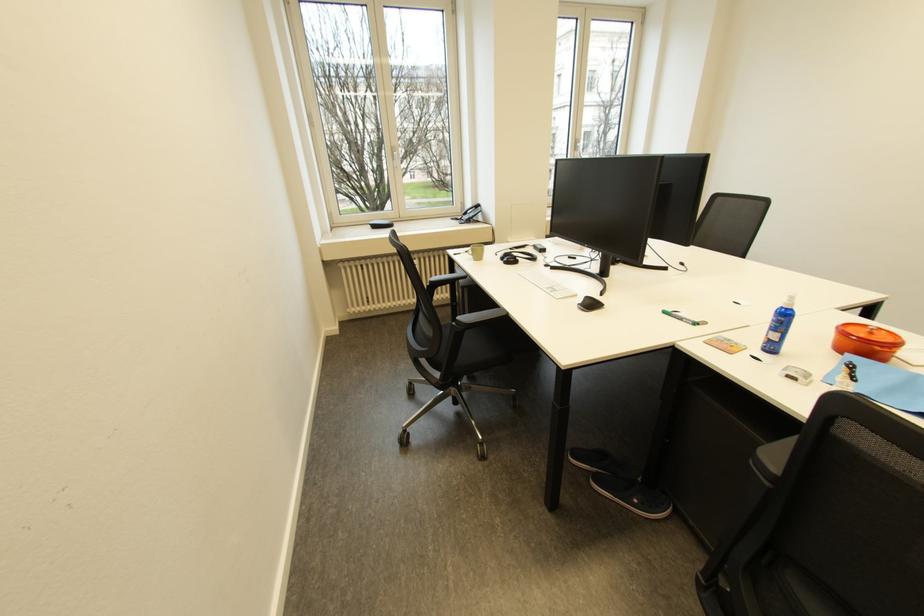
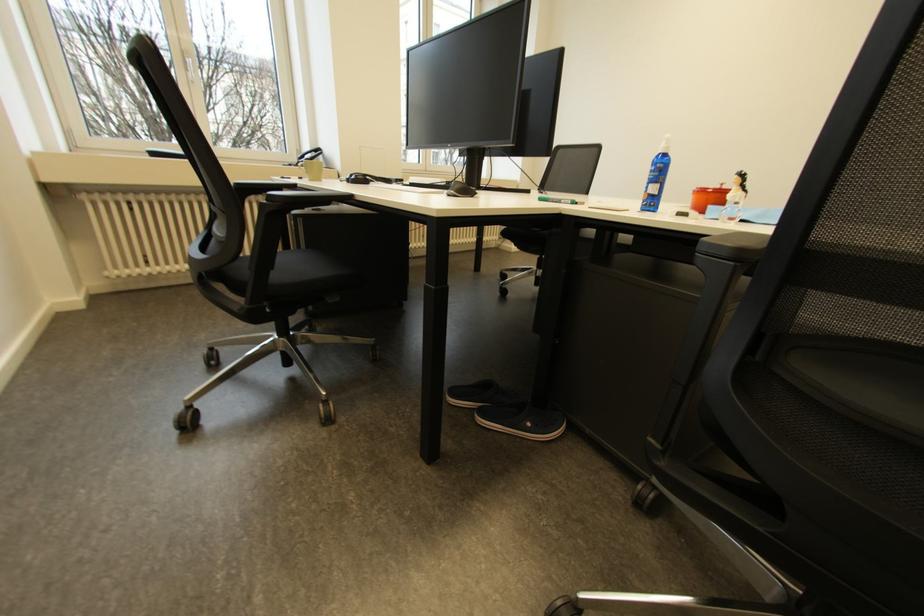
Question: Which direction would the cameraman need to move to produce the second image? Reply with the corresponding letter.

Choices:
 (A) Left
 (B) Right
 (C) Forward
 (D) Backward

Answer: (C)